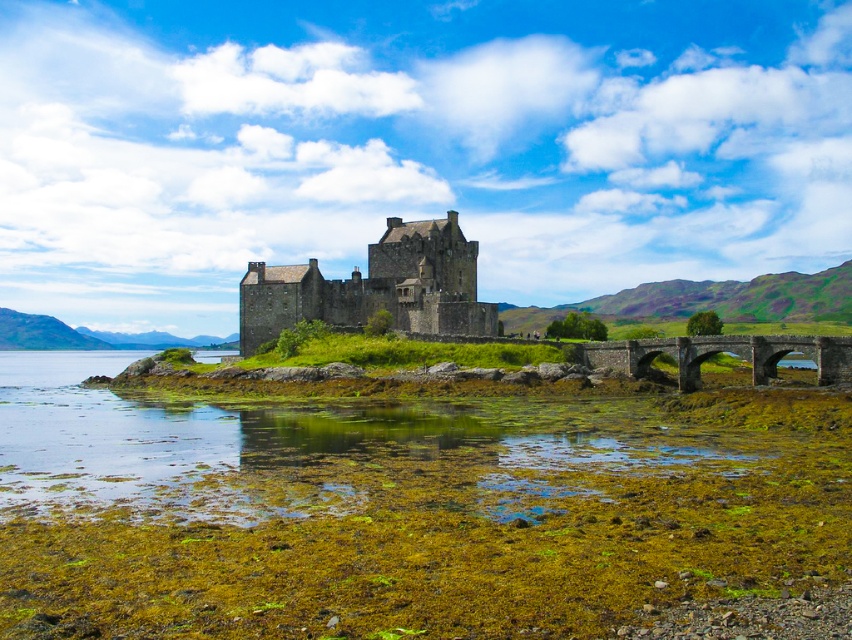
Question: Is brown stone castle at center positioned before stone arch bridge at center?

Choices:
 (A) no
 (B) yes

Answer: (A)

Question: Which object is the closest to the green mossy water at lower center?

Choices:
 (A) brown stone castle at center
 (B) stone arch bridge at center

Answer: (A)

Question: Can you confirm if brown stone castle at center is smaller than stone arch bridge at center?

Choices:
 (A) yes
 (B) no

Answer: (B)

Question: Which object is farther from the camera taking this photo?

Choices:
 (A) brown stone castle at center
 (B) stone arch bridge at center

Answer: (A)

Question: Which point is closer to the camera?

Choices:
 (A) (833, 371)
 (B) (332, 305)
 (C) (327, 449)

Answer: (C)

Question: Can you confirm if green mossy water at lower center is positioned to the right of brown stone castle at center?

Choices:
 (A) no
 (B) yes

Answer: (A)